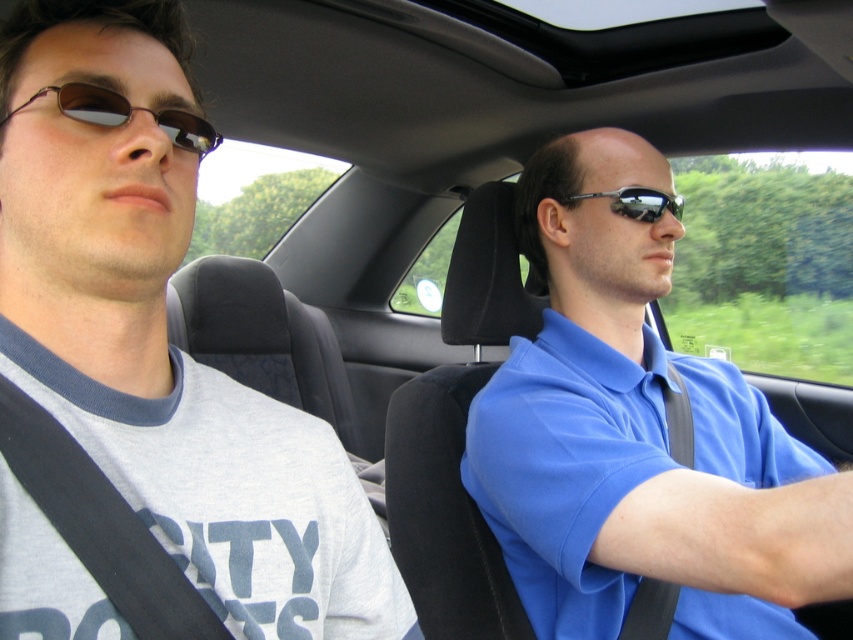
Question: Which point appears farthest from the camera in this image?

Choices:
 (A) (560, 586)
 (B) (248, 614)
 (C) (624, 193)
 (D) (65, 100)

Answer: (C)

Question: Is gray cotton t-shirt at left below matte brown sunglasses at left?

Choices:
 (A) no
 (B) yes

Answer: (B)

Question: Which point is farther to the camera?

Choices:
 (A) matte brown sunglasses at left
 (B) shiny black sunglasses at center

Answer: (B)

Question: Which of the following is the farthest from the observer?

Choices:
 (A) (57, 93)
 (B) (654, 204)
 (C) (576, 339)
 (D) (67, 225)

Answer: (B)

Question: Is blue cotton shirt at center to the right of matte brown sunglasses at left from the viewer's perspective?

Choices:
 (A) yes
 (B) no

Answer: (A)

Question: Where is gray cotton t-shirt at left located in relation to matte brown sunglasses at left in the image?

Choices:
 (A) left
 (B) right

Answer: (B)